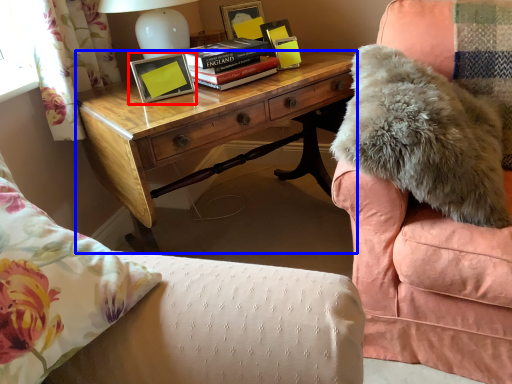
Question: Which object appears farthest to the camera in this image, picture frame (highlighted by a red box) or desk (highlighted by a blue box)?

Choices:
 (A) picture frame
 (B) desk

Answer: (A)